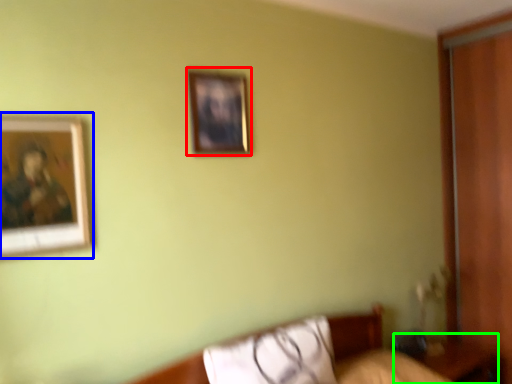
Question: Which object is the closest to the picture frame (highlighted by a red box)? Choose among these: picture frame (highlighted by a blue box) or table (highlighted by a green box).

Choices:
 (A) picture frame
 (B) table

Answer: (A)